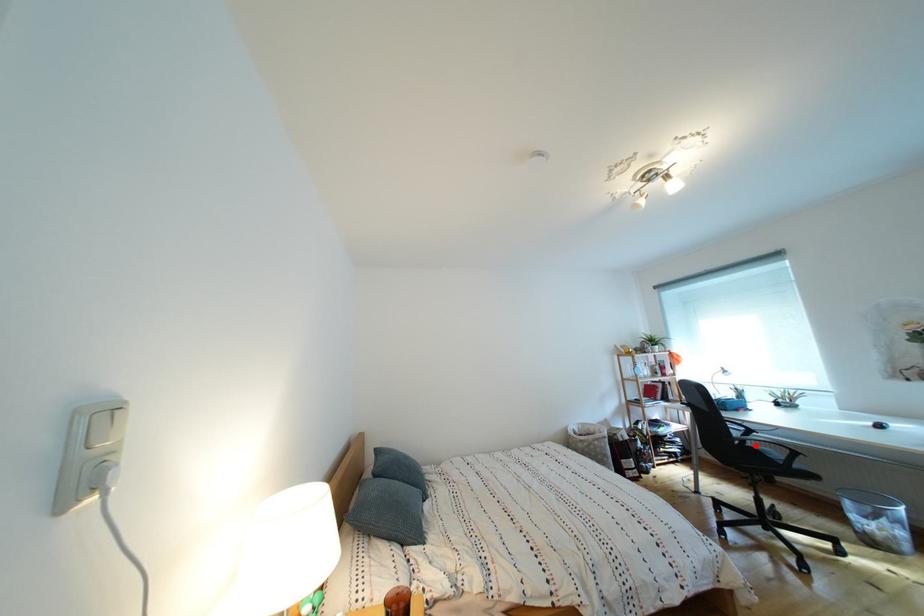
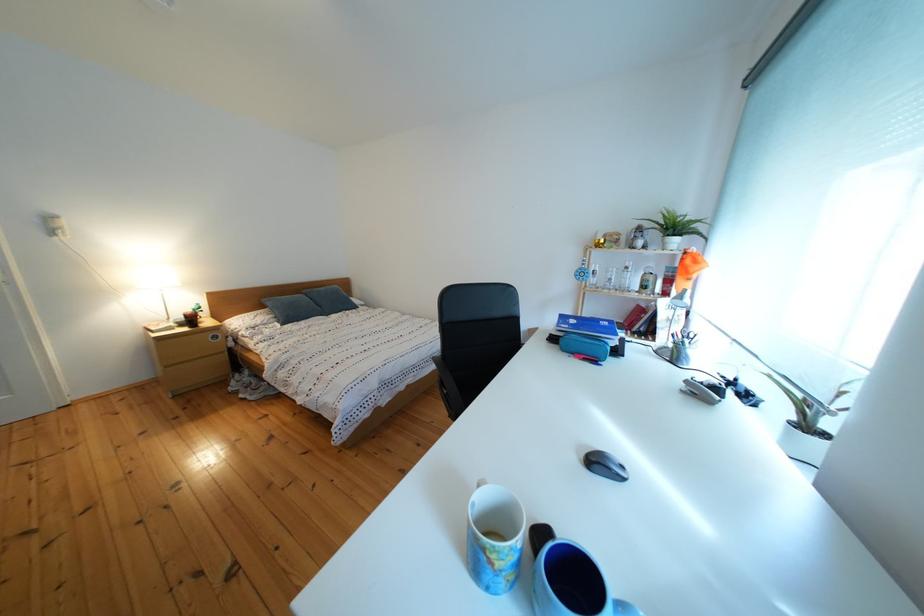
Question: I am providing you with two images of the same scene from different viewpoints. A red point is marked on the first image. At the location where the point appears in image 1, is it still visible in image 2?

Choices:
 (A) Yes
 (B) No

Answer: (B)